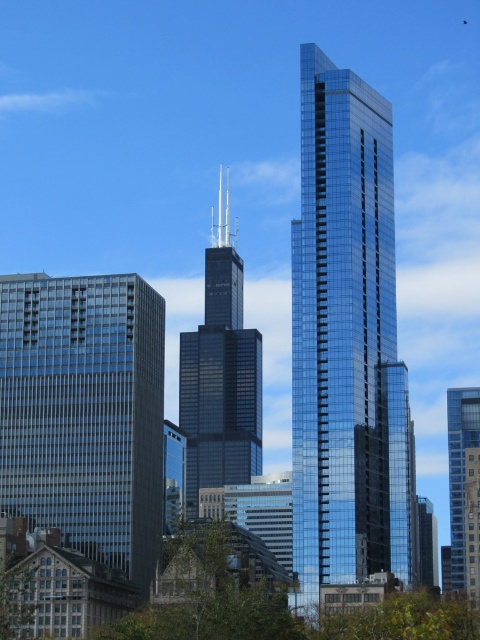
You are standing in the city square and want to take a photo of both the shiny glass skyscraper at center and the glassy blue skyscraper at right. Which skyscraper should you position yourself closer to in order to capture both in the same frame?

You should position yourself closer to the shiny glass skyscraper at center because it is nearer to you than the glassy blue skyscraper at right, allowing both to be included in the photo frame more easily.

You are standing in the city park and see the glassy blue skyscraper at right and the green leafy tree at lower left. Which object is positioned to the right of the other?

The glassy blue skyscraper at right is to the right of the green leafy tree at lower left.